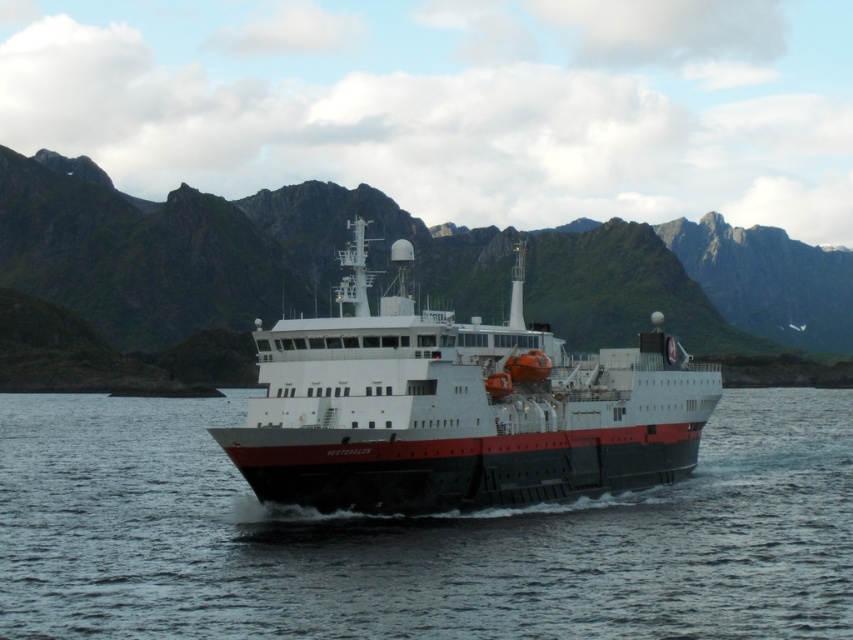
You are an observer on the ship and see the black water at center and the white matte ship at center. Which object is positioned lower in the image?

The black water at center is located below the white matte ship at center, so it is positioned lower in the image.

You are an observer on the ship and notice the black water at center and the white matte ship at center. Which object is positioned to the right of the other?

The black water at center is to the right of the white matte ship at center according to the description.